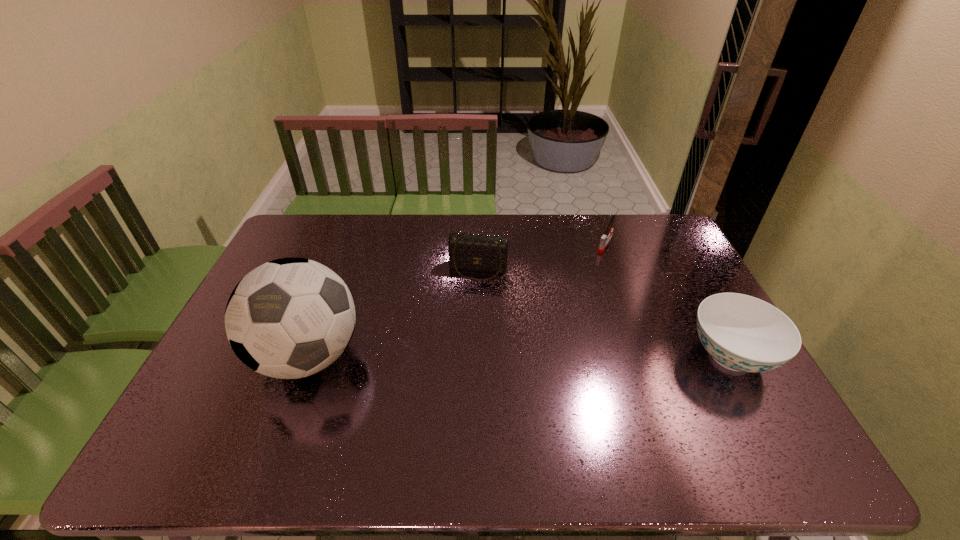
What are the coordinates of `free region located 0.270m on the handle side of the stapler` in the screenshot? It's located at (572, 296).

The width and height of the screenshot is (960, 540). I want to click on free space located on the front flap of the third object from right to left, so click(460, 341).

Find the location of a particular element. The width and height of the screenshot is (960, 540). free space located on the front flap of the third object from right to left is located at coordinates (466, 315).

Where is `free space located 0.170m on the front flap of the third object from right to left`? The image size is (960, 540). free space located 0.170m on the front flap of the third object from right to left is located at coordinates (466, 318).

Find the location of a particular element. The width and height of the screenshot is (960, 540). object located at the far edge is located at coordinates (604, 240).

Locate an element on the screen. soccer ball that is positioned at the near edge is located at coordinates (289, 318).

The height and width of the screenshot is (540, 960). In order to click on chinaware that is at the near edge in this screenshot , I will do click(x=742, y=333).

This screenshot has height=540, width=960. I want to click on object located in the left edge section of the desktop, so click(x=289, y=318).

Locate an element on the screen. Image resolution: width=960 pixels, height=540 pixels. object at the right edge is located at coordinates (742, 333).

The height and width of the screenshot is (540, 960). Identify the location of object present at the near left corner. (289, 318).